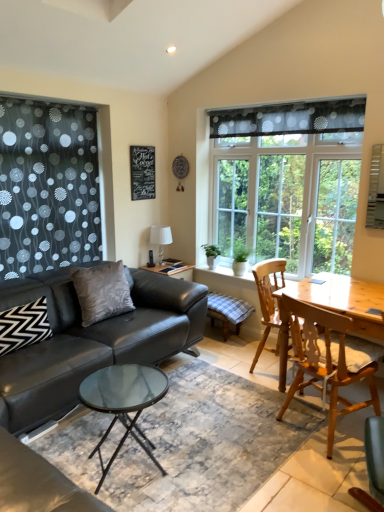
Question: Does chalkboard at upper center come in front of white glossy lampshade at upper center?

Choices:
 (A) no
 (B) yes

Answer: (B)

Question: Can you confirm if chalkboard at upper center is taller than white glossy lampshade at upper center?

Choices:
 (A) yes
 (B) no

Answer: (A)

Question: Does chalkboard at upper center have a lesser height compared to white glossy lampshade at upper center?

Choices:
 (A) yes
 (B) no

Answer: (B)

Question: Is chalkboard at upper center facing towards white glossy lampshade at upper center?

Choices:
 (A) yes
 (B) no

Answer: (B)

Question: Is chalkboard at upper center surrounding white glossy lampshade at upper center?

Choices:
 (A) no
 (B) yes

Answer: (A)

Question: Is chalkboard at upper center not near white glossy lampshade at upper center?

Choices:
 (A) no
 (B) yes

Answer: (A)

Question: Would you consider translucent polka dot curtain at upper center to be distant from chalkboard at upper center?

Choices:
 (A) no
 (B) yes

Answer: (B)

Question: Is chalkboard at upper center located within translucent polka dot curtain at upper center?

Choices:
 (A) no
 (B) yes

Answer: (A)

Question: From a real-world perspective, is translucent polka dot curtain at upper center beneath chalkboard at upper center?

Choices:
 (A) no
 (B) yes

Answer: (A)

Question: Can you confirm if translucent polka dot curtain at upper center is positioned to the right of chalkboard at upper center?

Choices:
 (A) yes
 (B) no

Answer: (A)

Question: Is translucent polka dot curtain at upper center with chalkboard at upper center?

Choices:
 (A) no
 (B) yes

Answer: (A)

Question: Does translucent polka dot curtain at upper center have a smaller size compared to chalkboard at upper center?

Choices:
 (A) no
 (B) yes

Answer: (A)

Question: Would you say wooden chair at right, placed as the 3th chair when sorted from front to back, is part of matte black chair at lower right, the first chair in the front-to-back sequence,'s contents?

Choices:
 (A) yes
 (B) no

Answer: (B)